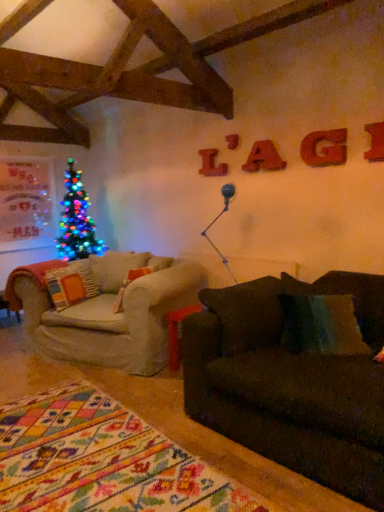
Question: Is metallic red letter at upper right, acting as the 4th letter starting from the left, completely or partially outside of matte red letter at upper center, the second letter from the left?

Choices:
 (A) no
 (B) yes

Answer: (B)

Question: Is metallic red letter at upper right, marked as the fourth letter in a back-to-front arrangement, at the left side of matte red letter at upper center, the 3th letter in the right-to-left sequence?

Choices:
 (A) yes
 (B) no

Answer: (B)

Question: Is metallic red letter at upper right, marked as the fourth letter in a back-to-front arrangement, closer to camera compared to matte red letter at upper center, positioned as the 2th letter in back-to-front order?

Choices:
 (A) no
 (B) yes

Answer: (B)

Question: From a real-world perspective, is metallic red letter at upper right, the 1th letter from the front, positioned over matte red letter at upper center, positioned as the 2th letter in back-to-front order, based on gravity?

Choices:
 (A) yes
 (B) no

Answer: (A)

Question: Is metallic red letter at upper right, the 1th letter from the front, to the right of matte red letter at upper center, positioned as the 2th letter in back-to-front order, from the viewer's perspective?

Choices:
 (A) yes
 (B) no

Answer: (A)

Question: Does point (201, 168) appear closer or farther from the camera than point (248, 164)?

Choices:
 (A) farther
 (B) closer

Answer: (A)

Question: Is red wood letter at upper center, placed as the 4th letter when sorted from front to back, to the left or to the right of matte red letter at upper center, the second letter from the left, in the image?

Choices:
 (A) right
 (B) left

Answer: (B)

Question: Is red wood letter at upper center, placed as the 4th letter when sorted from front to back, in front of or behind matte red letter at upper center, positioned as the 2th letter in back-to-front order, in the image?

Choices:
 (A) behind
 (B) front

Answer: (A)

Question: From a real-world perspective, is red wood letter at upper center, the first letter when ordered from back to front, physically located above or below matte red letter at upper center, the 3th letter in the right-to-left sequence?

Choices:
 (A) below
 (B) above

Answer: (B)

Question: Considering the positions of point (317, 150) and point (370, 155), is point (317, 150) closer or farther from the camera than point (370, 155)?

Choices:
 (A) closer
 (B) farther

Answer: (B)

Question: Is matte orange letter g at upper right, the third letter positioned from the left, in front of or behind metallic red letter at upper right, the 1th letter from the front, in the image?

Choices:
 (A) behind
 (B) front

Answer: (A)

Question: Would you say matte orange letter g at upper right, the third letter positioned from the left, is inside or outside metallic red letter at upper right, the 1th letter from the front?

Choices:
 (A) inside
 (B) outside

Answer: (B)

Question: Based on their sizes in the image, would you say matte orange letter g at upper right, arranged as the 2th letter when viewed from the front, is bigger or smaller than metallic red letter at upper right, the 1th letter from the front?

Choices:
 (A) small
 (B) big

Answer: (A)

Question: From their relative heights in the image, would you say matte orange letter g at upper right, placed as the 3th letter when sorted from back to front, is taller or shorter than orange fabric pillow at left?

Choices:
 (A) short
 (B) tall

Answer: (A)

Question: Considering the positions of matte orange letter g at upper right, placed as the 3th letter when sorted from back to front, and orange fabric pillow at left in the image, is matte orange letter g at upper right, placed as the 3th letter when sorted from back to front, bigger or smaller than orange fabric pillow at left?

Choices:
 (A) small
 (B) big

Answer: (A)